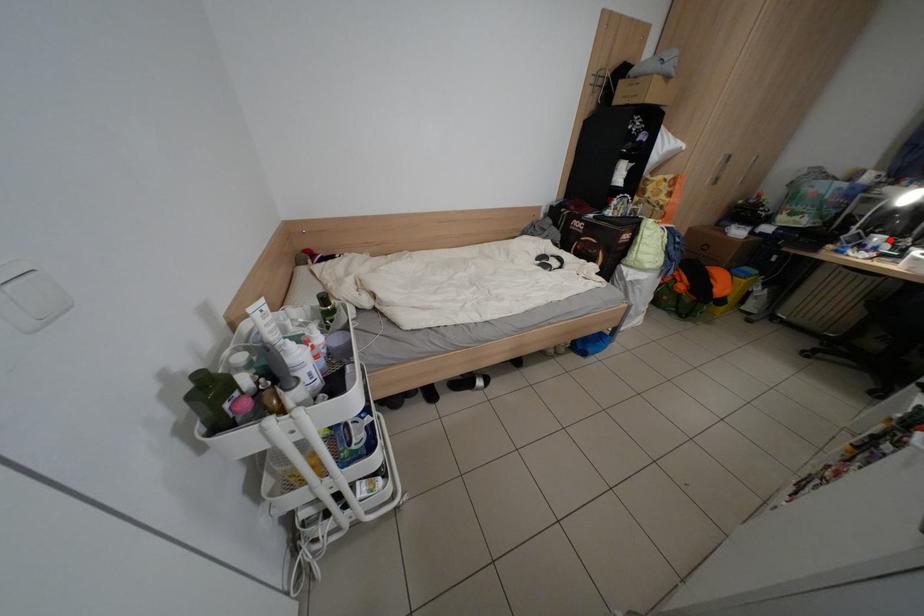
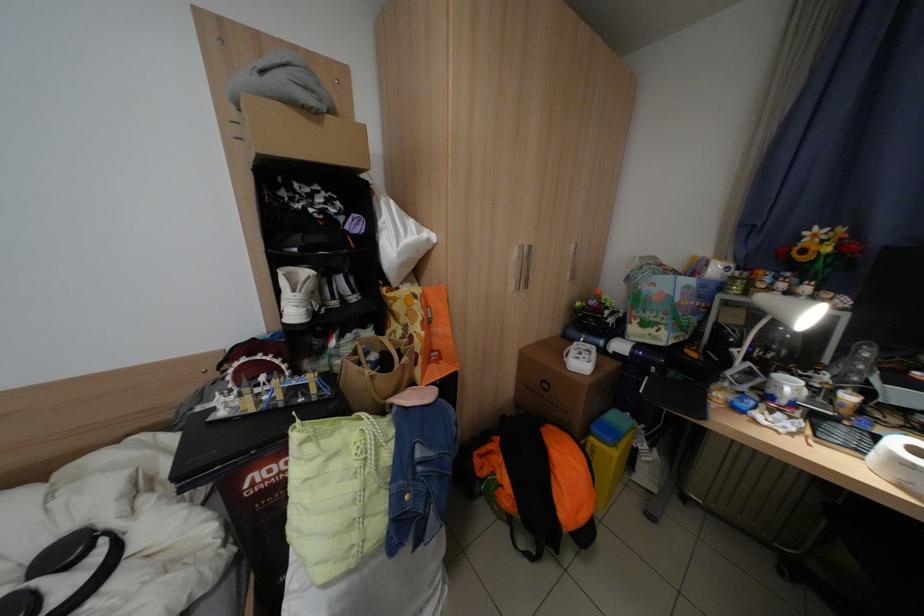
Question: I am providing you with two images of the same scene from different viewpoints. A red point is shown in image1. For the corresponding object point in image2, is it positioned nearer or farther from the camera?

Choices:
 (A) Nearer
 (B) Farther

Answer: (A)